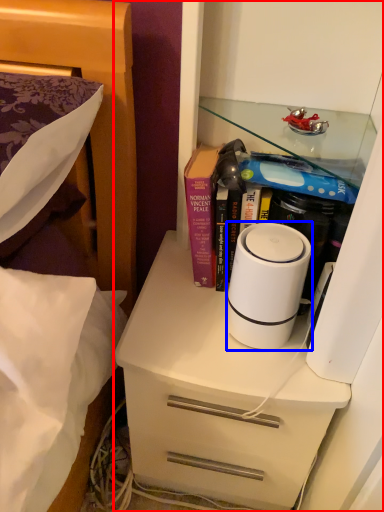
Question: Among these objects, which one is farthest to the camera, cabinetry (highlighted by a red box) or home appliance (highlighted by a blue box)?

Choices:
 (A) cabinetry
 (B) home appliance

Answer: (B)